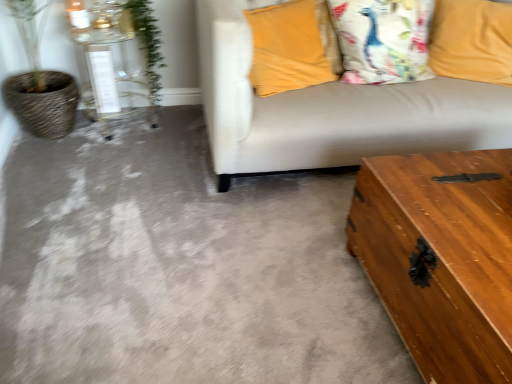
Question: Considering the relative sizes of yellow fabric pillow at upper right, the 3th pillow from the left, and wooden trunk at lower right, the 2th table in the left-to-right sequence, in the image provided, is yellow fabric pillow at upper right, the 3th pillow from the left, shorter than wooden trunk at lower right, the 2th table in the left-to-right sequence,?

Choices:
 (A) no
 (B) yes

Answer: (A)

Question: Is yellow fabric pillow at upper right, the 3th pillow from the left, closer to the viewer compared to wooden trunk at lower right, the first table in the right-to-left sequence?

Choices:
 (A) no
 (B) yes

Answer: (A)

Question: From a real-world perspective, is yellow fabric pillow at upper right, the first pillow from the right, physically below wooden trunk at lower right, which is the first table in front-to-back order?

Choices:
 (A) yes
 (B) no

Answer: (B)

Question: Is yellow fabric pillow at upper right, the 3th pillow from the left, wider than wooden trunk at lower right, the 2th table in the left-to-right sequence?

Choices:
 (A) no
 (B) yes

Answer: (A)

Question: Can we say yellow fabric pillow at upper right, the first pillow from the right, lies outside wooden trunk at lower right, acting as the 2th table starting from the top?

Choices:
 (A) no
 (B) yes

Answer: (B)

Question: Is yellow fabric pillow at upper right, the 3th pillow from the left, turned away from wooden trunk at lower right, which is the first table in front-to-back order?

Choices:
 (A) no
 (B) yes

Answer: (A)

Question: Can you confirm if wooden trunk at lower right is bigger than green leafy plant at upper left?

Choices:
 (A) no
 (B) yes

Answer: (B)

Question: Is wooden trunk at lower right positioned before green leafy plant at upper left?

Choices:
 (A) no
 (B) yes

Answer: (B)

Question: From a real-world perspective, is wooden trunk at lower right over green leafy plant at upper left?

Choices:
 (A) yes
 (B) no

Answer: (B)

Question: Can you confirm if wooden trunk at lower right is shorter than green leafy plant at upper left?

Choices:
 (A) yes
 (B) no

Answer: (A)

Question: Are wooden trunk at lower right and green leafy plant at upper left beside each other?

Choices:
 (A) yes
 (B) no

Answer: (B)

Question: Is wooden trunk at lower right taller than green leafy plant at upper left?

Choices:
 (A) yes
 (B) no

Answer: (B)

Question: Is the depth of yellow fabric pillow at upper right, the first pillow from the right, greater than that of green leafy plant at upper left?

Choices:
 (A) no
 (B) yes

Answer: (B)